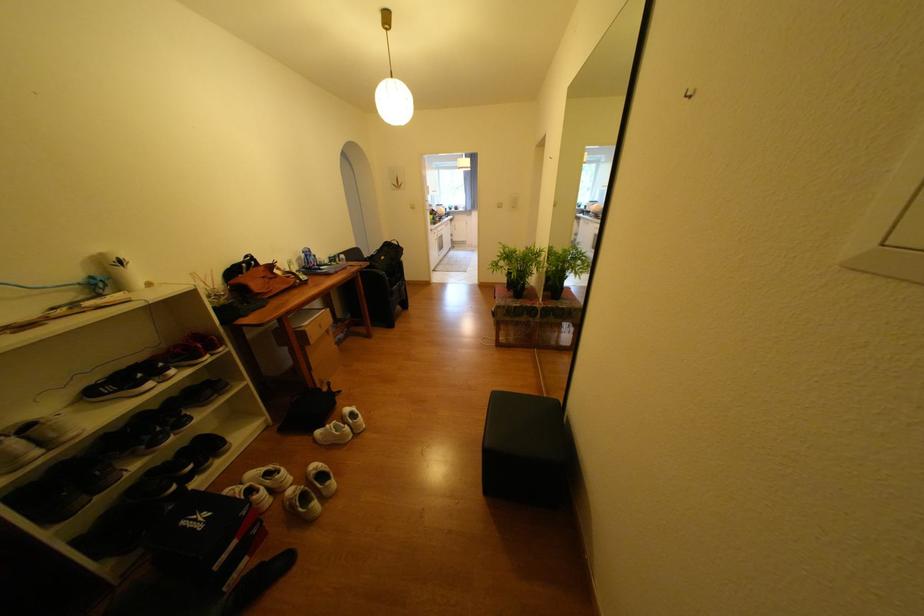
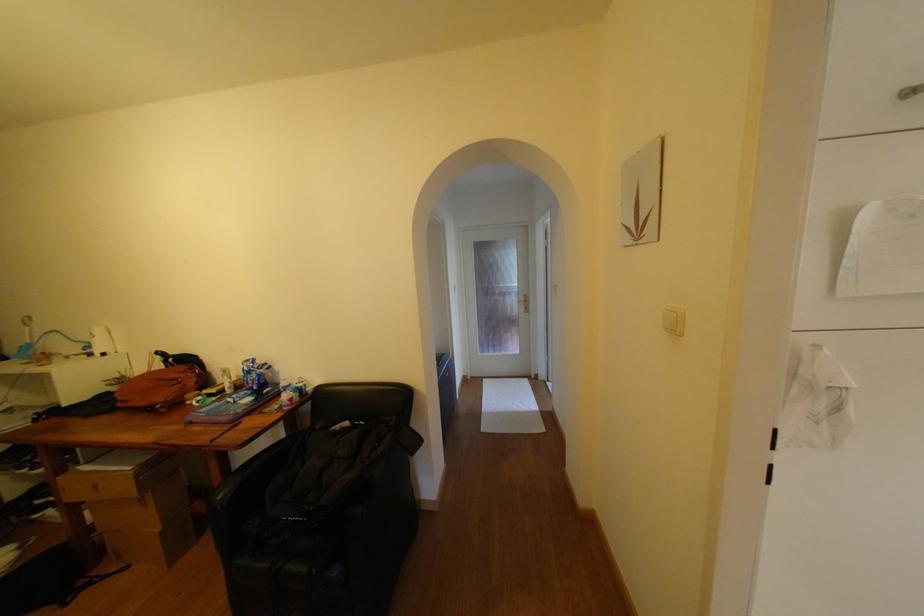
The point at (271,269) is marked in the first image. Where is the corresponding point in the second image?

(190, 369)